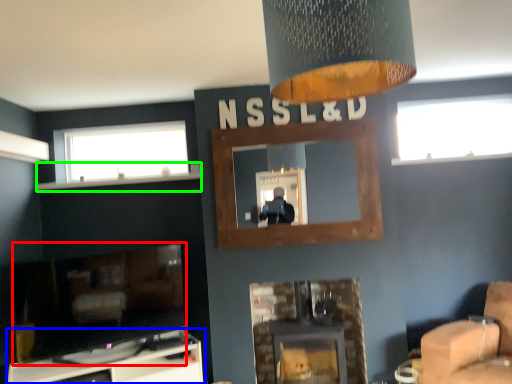
Question: Which object is positioned farthest from fireplace (highlighted by a red box)? Select from furniture (highlighted by a blue box) and mantle (highlighted by a green box).

Choices:
 (A) furniture
 (B) mantle

Answer: (B)